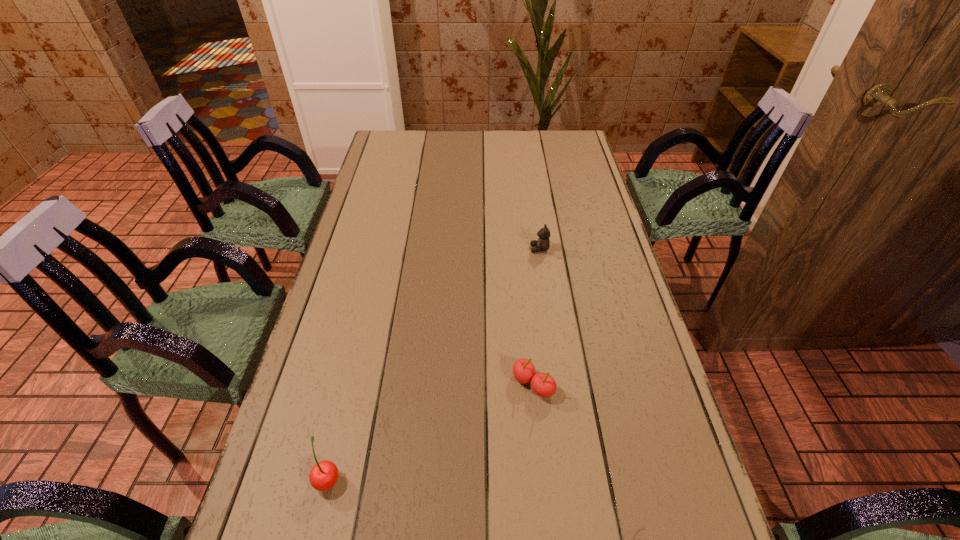
This screenshot has width=960, height=540. What are the coordinates of `vacant area between the farthest object and the nearer cherry` in the screenshot? It's located at (434, 363).

Locate an element on the screen. free space between the taller cherry and the teddy bear is located at coordinates pos(434,363).

Locate which object is the second closest to the farthest object. Please provide its 2D coordinates. Your answer should be formatted as a tuple, i.e. [(x, y)], where the tuple contains the x and y coordinates of a point satisfying the conditions above.

[(323, 476)]

This screenshot has width=960, height=540. Identify the location of object that is the second nearest to the farthest object. (323, 476).

Find the location of a particular element. This screenshot has height=540, width=960. free point that satisfies the following two spatial constraints: 1. on the face of the teddy bear; 2. on the front side of the tallest object is located at coordinates (572, 478).

This screenshot has height=540, width=960. I want to click on free spot that satisfies the following two spatial constraints: 1. on the face of the farthest object; 2. on the front side of the second nearest object, so click(559, 384).

In order to click on free spot that satisfies the following two spatial constraints: 1. on the back side of the left cherry; 2. on the right side of the right cherry in this screenshot , I will do `click(350, 384)`.